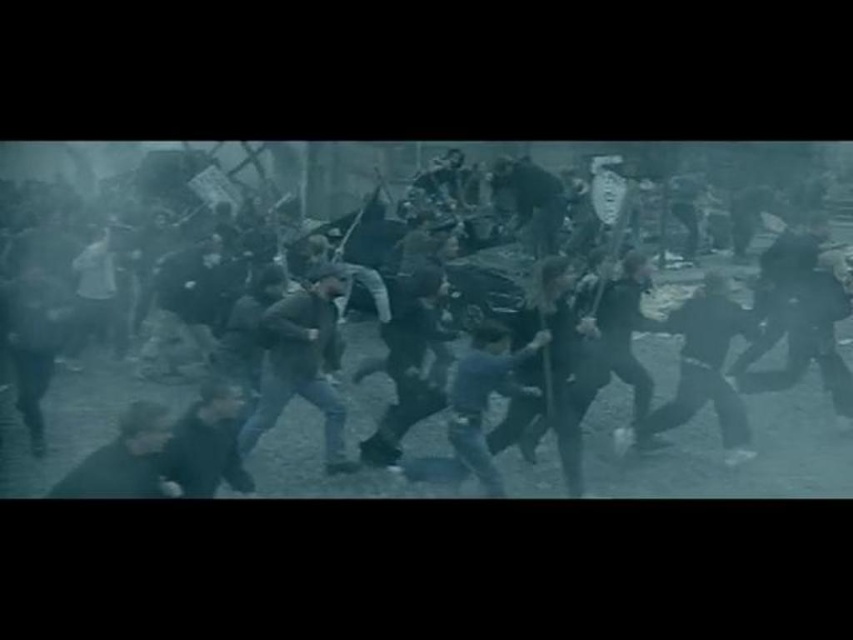
Can you confirm if dark gray fabric jacket at lower left is shorter than dark gray fabric at lower left?

No, dark gray fabric jacket at lower left is not shorter than dark gray fabric at lower left.

Is point (235, 452) positioned behind point (173, 490)?

Yes, point (235, 452) is farther from viewer.

Who is more forward, (186,451) or (125,468)?

Point (125,468) is in front.

The image size is (853, 640). Identify the location of dark gray fabric jacket at lower left. (207, 444).

Is dark gray fabric crowd at center above dark blue jeans at center?

Correct, dark gray fabric crowd at center is located above dark blue jeans at center.

This screenshot has width=853, height=640. Describe the element at coordinates (183, 268) in the screenshot. I see `dark gray fabric crowd at center` at that location.

Describe the element at coordinates (183, 268) in the screenshot. The height and width of the screenshot is (640, 853). I see `dark gray fabric crowd at center` at that location.

Identify the location of dark gray fabric crowd at center. This screenshot has height=640, width=853. (183, 268).

Which is behind, point (311, 324) or point (247, 477)?

Positioned behind is point (311, 324).

What do you see at coordinates (302, 364) in the screenshot?
I see `dark blue jeans at center` at bounding box center [302, 364].

Describe the element at coordinates (302, 364) in the screenshot. The width and height of the screenshot is (853, 640). I see `dark blue jeans at center` at that location.

You are a GUI agent. You are given a task and a screenshot of the screen. Output one action in this format:
    pyautogui.click(x=<x>, y=<y>)
    Task: Click on the dark blue jeans at center
    This screenshot has width=853, height=640.
    Given the screenshot: What is the action you would take?
    pyautogui.click(x=302, y=364)